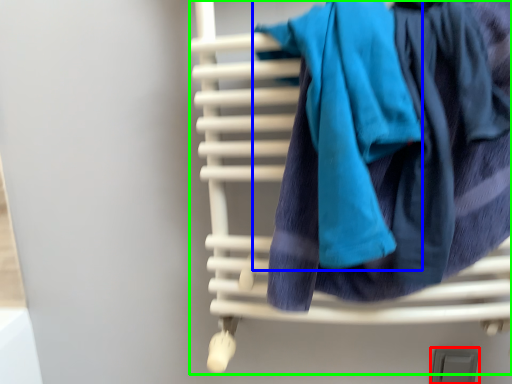
Question: Estimate the real-world distances between objects in this image. Which object is closer to window (highlighted by a red box), bath towel (highlighted by a blue box) or furniture (highlighted by a green box)?

Choices:
 (A) bath towel
 (B) furniture

Answer: (B)